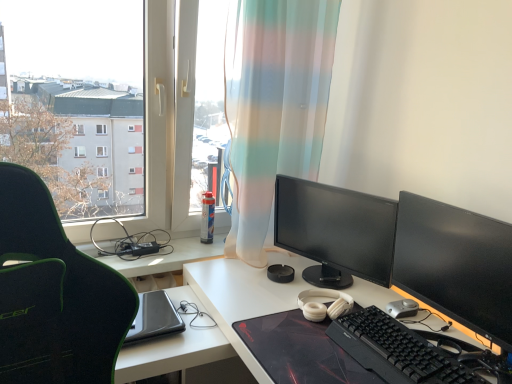
Locate an element on the screen. This screenshot has height=384, width=512. vacant space to the right of white matte headphones at center is located at coordinates (372, 297).